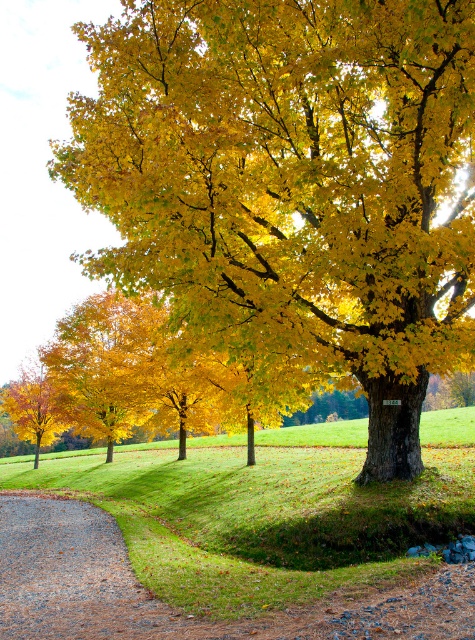
Does golden matte tree at center have a lesser width compared to gravelly dirt path at lower left?

In fact, golden matte tree at center might be wider than gravelly dirt path at lower left.

Is golden matte tree at center to the right of gravelly dirt path at lower left from the viewer's perspective?

Incorrect, golden matte tree at center is not on the right side of gravelly dirt path at lower left.

Does point (174, 163) come closer to viewer compared to point (178, 616)?

No, (174, 163) is further to viewer.

Locate an element on the screen. golden matte tree at center is located at coordinates (294, 182).